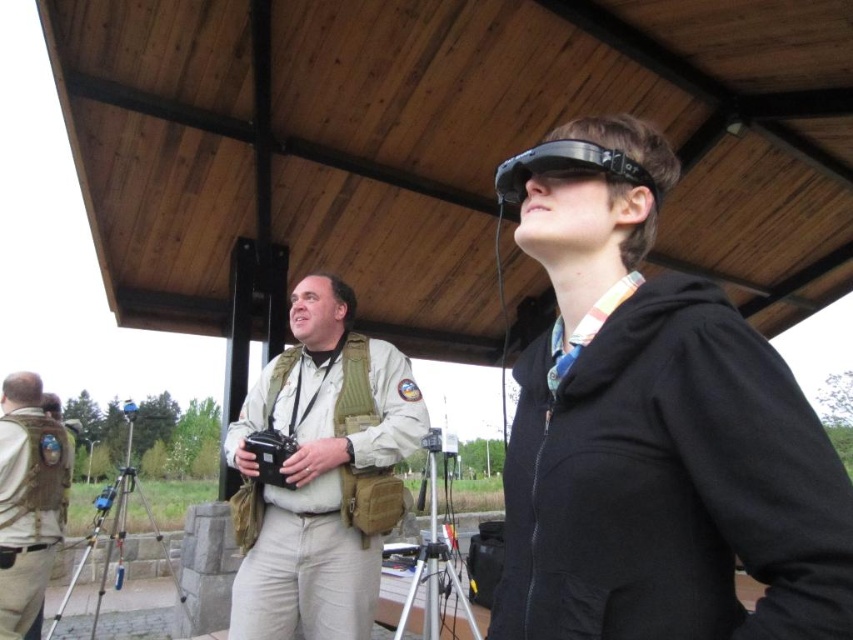
Question: Based on their relative distances, which object is nearer to the blue plastic tripod at lower left?

Choices:
 (A) tan fabric vest at center
 (B) silver metallic tripod at lower center
 (C) black matte vr headset at upper right

Answer: (B)

Question: Can you confirm if black matte vr headset at upper right is positioned above camouflage fabric vest at center?

Choices:
 (A) no
 (B) yes

Answer: (B)

Question: Is black matte vr headset at upper right positioned behind tan fabric vest at center?

Choices:
 (A) no
 (B) yes

Answer: (A)

Question: Which point is closer to the camera taking this photo?

Choices:
 (A) (35, 608)
 (B) (526, 164)
 (C) (665, 620)
 (D) (311, 339)

Answer: (C)

Question: Is camouflage fabric vest at center smaller than blue plastic tripod at lower left?

Choices:
 (A) no
 (B) yes

Answer: (A)

Question: Which of the following is the closest to the observer?

Choices:
 (A) (288, 417)
 (B) (726, 304)
 (C) (389, 545)

Answer: (B)